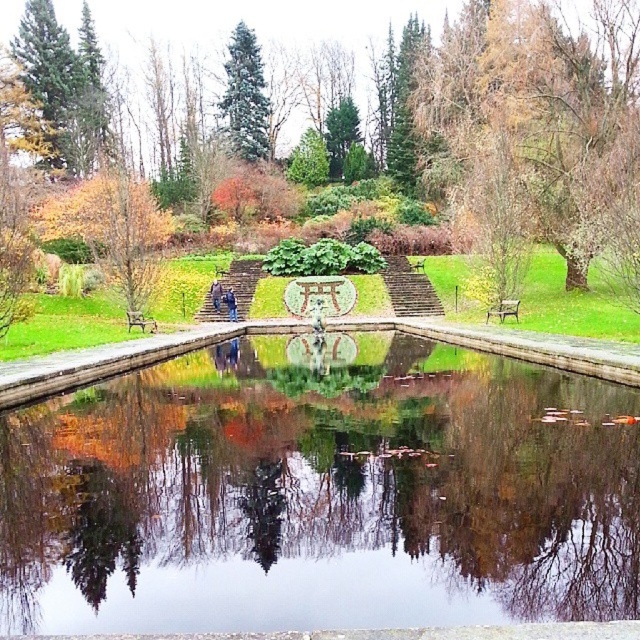
Question: Among these points, which one is nearest to the camera?

Choices:
 (A) (506, 304)
 (B) (600, 189)
 (C) (67, 579)

Answer: (C)

Question: Does green wooden bench at center have a lesser width compared to wooden park bench at center?

Choices:
 (A) yes
 (B) no

Answer: (A)

Question: Can you confirm if brown textured tree at right is positioned to the right of green matte tree at upper center?

Choices:
 (A) no
 (B) yes

Answer: (B)

Question: Can you confirm if brown textured tree at right is positioned to the left of green wooden bench at center?

Choices:
 (A) no
 (B) yes

Answer: (A)

Question: Estimate the real-world distances between objects in this image. Which object is closer to the green wooden bench at center?

Choices:
 (A) green matte tree at upper center
 (B) wooden park bench at center

Answer: (B)

Question: Which of these objects is positioned closest to the green wooden bench at center?

Choices:
 (A) green matte tree at upper center
 (B) wooden park bench at center

Answer: (B)